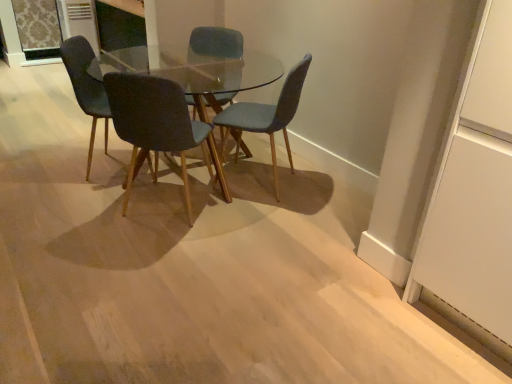
Locate an element on the screen. The height and width of the screenshot is (384, 512). vacant space that's between transparent glass table at center and transparent glass door at upper right is located at coordinates (309, 244).